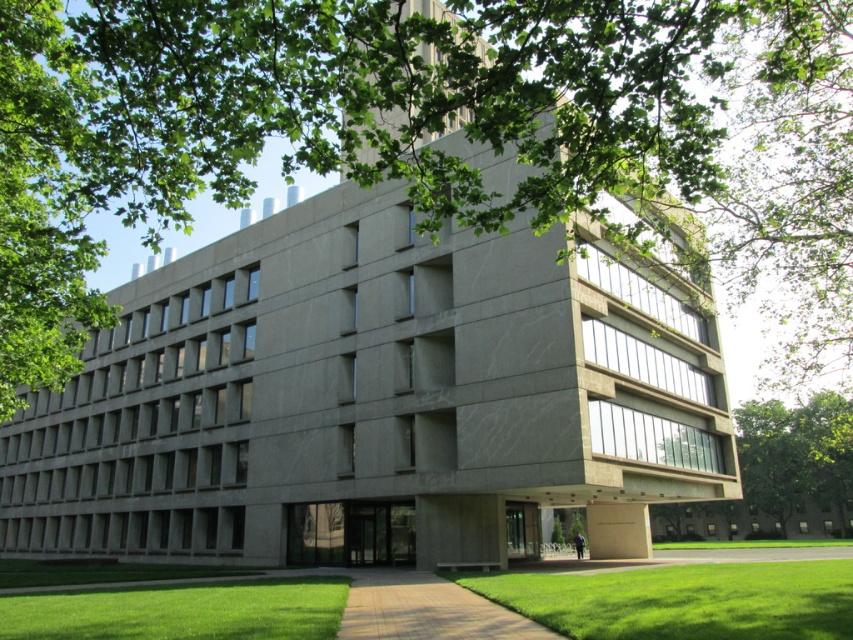
Question: Which point is farther to the camera?

Choices:
 (A) brick paved path at center
 (B) green grass at lower center

Answer: (A)

Question: Which point is closer to the camera?

Choices:
 (A) (556, 93)
 (B) (44, 634)
 (C) (782, 445)
 (D) (526, 621)

Answer: (A)

Question: Among these objects, which one is farthest from the camera?

Choices:
 (A) green grass at lower center
 (B) brick paved path at center

Answer: (B)

Question: Can you confirm if green grass at lower center is positioned to the right of green leafy tree at lower right?

Choices:
 (A) yes
 (B) no

Answer: (B)

Question: Does green grass at lower center lie in front of green grass at lower left?

Choices:
 (A) no
 (B) yes

Answer: (B)

Question: Is green leafy tree at upper left thinner than green grass at lower left?

Choices:
 (A) no
 (B) yes

Answer: (A)